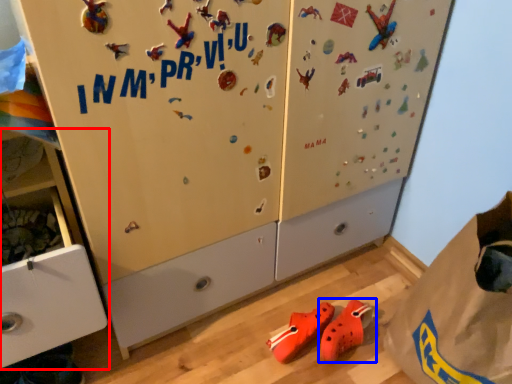
Question: Which object is further to the camera taking this photo, cabinetry (highlighted by a red box) or footwear (highlighted by a blue box)?

Choices:
 (A) cabinetry
 (B) footwear

Answer: (B)